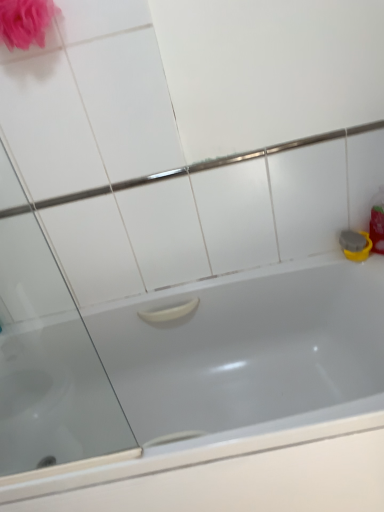
Question: Considering the relative positions of matte pink sponge at upper left and white glossy bathtub at center in the image provided, is matte pink sponge at upper left to the left or to the right of white glossy bathtub at center?

Choices:
 (A) right
 (B) left

Answer: (B)

Question: From the image's perspective, is matte pink sponge at upper left positioned above or below white glossy bathtub at center?

Choices:
 (A) below
 (B) above

Answer: (B)

Question: In terms of width, does matte pink sponge at upper left look wider or thinner when compared to white glossy bathtub at center?

Choices:
 (A) thin
 (B) wide

Answer: (A)

Question: From their relative heights in the image, would you say white glossy bathtub at center is taller or shorter than matte pink sponge at upper left?

Choices:
 (A) short
 (B) tall

Answer: (B)

Question: From a real-world perspective, relative to matte pink sponge at upper left, is white glossy bathtub at center vertically above or below?

Choices:
 (A) below
 (B) above

Answer: (A)

Question: Would you say white glossy bathtub at center is to the left or to the right of matte pink sponge at upper left in the picture?

Choices:
 (A) left
 (B) right

Answer: (B)

Question: From the image's perspective, is white glossy bathtub at center positioned above or below matte pink sponge at upper left?

Choices:
 (A) below
 (B) above

Answer: (A)